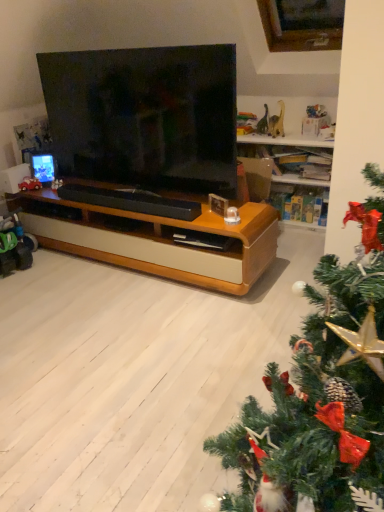
Question: From the image's perspective, is black matte soundbar at center located above or below metallic red car at left, the 2th toy when ordered from bottom to top?

Choices:
 (A) above
 (B) below

Answer: (B)

Question: Considering the positions of point (140, 205) and point (29, 184), is point (140, 205) closer or farther from the camera than point (29, 184)?

Choices:
 (A) farther
 (B) closer

Answer: (B)

Question: Which of these objects is positioned closest to the metallic red car at left, the second toy from the front?

Choices:
 (A) matte black tv at center
 (B) green plastic toy at left, placed as the 1th toy when sorted from bottom to top
 (C) black matte soundbar at center

Answer: (B)

Question: Which object is the closest to the matte black tv at center?

Choices:
 (A) metallic red car at left, the second toy from the front
 (B) green plastic toy at left, placed as the 1th toy when sorted from bottom to top
 (C) black matte soundbar at center

Answer: (C)